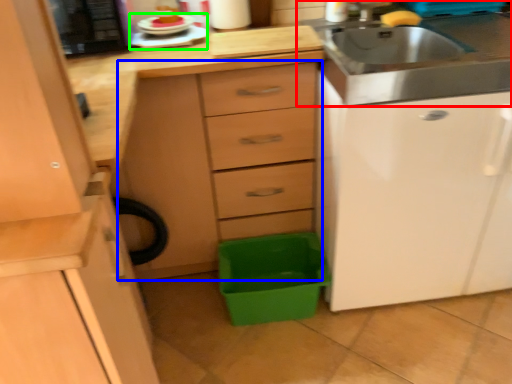
Question: Based on their relative distances, which object is farther from sink (highlighted by a red box)? Choose from chest of drawers (highlighted by a blue box) and appliance (highlighted by a green box).

Choices:
 (A) chest of drawers
 (B) appliance

Answer: (B)